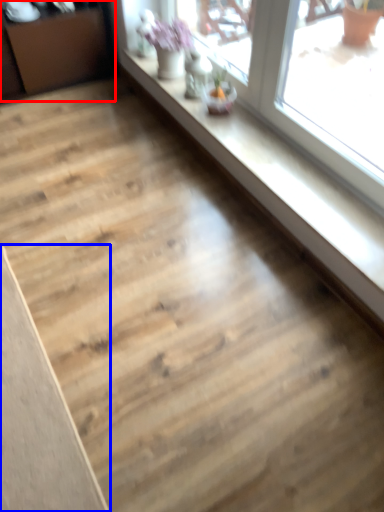
Question: Among these objects, which one is farthest to the camera, dresser (highlighted by a red box) or plank (highlighted by a blue box)?

Choices:
 (A) dresser
 (B) plank

Answer: (A)